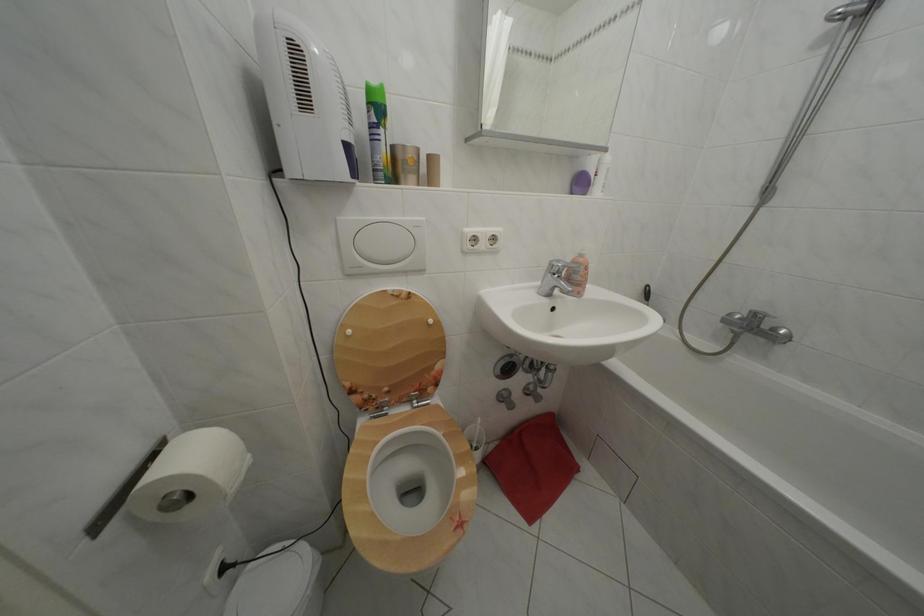
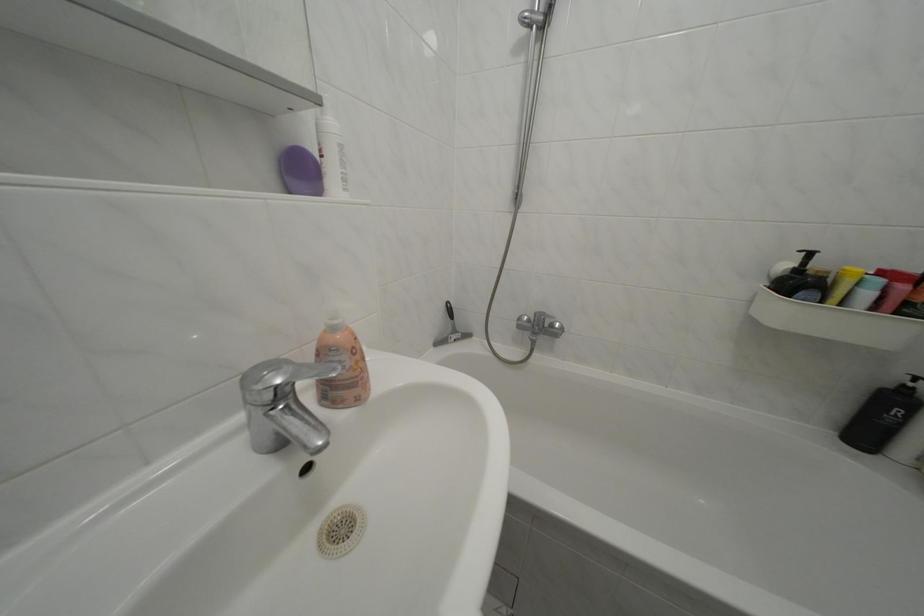
The point at (783,336) is marked in the first image. Where is the corresponding point in the second image?

(562, 331)